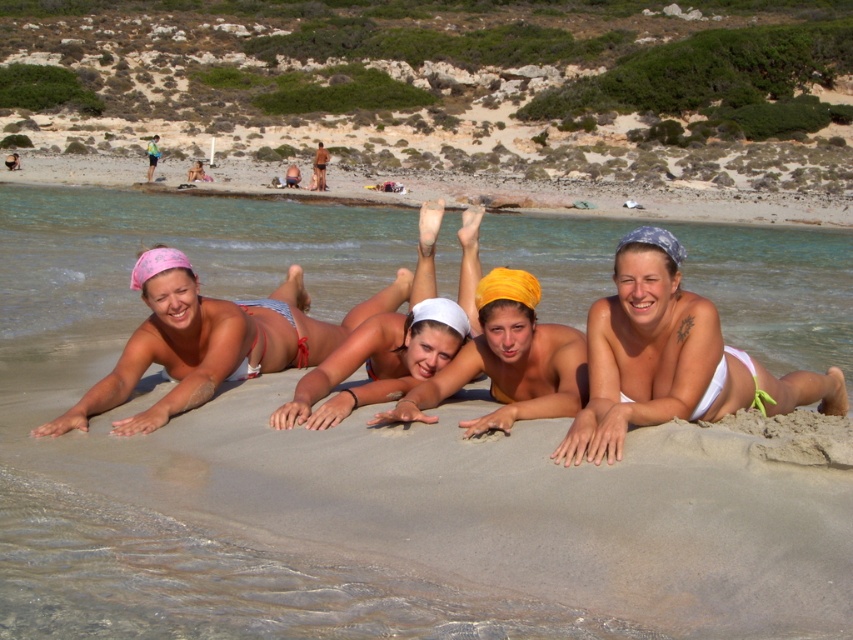
Does white sand at center appear over yellow fabric headscarf at center?

Correct, white sand at center is located above yellow fabric headscarf at center.

Is white sand at center wider than yellow fabric headscarf at center?

Correct, the width of white sand at center exceeds that of yellow fabric headscarf at center.

From the picture: Measure the distance between point (322, 269) and camera.

Point (322, 269) and camera are 48.03 feet apart.

Find the location of a particular element. The height and width of the screenshot is (640, 853). white sand at center is located at coordinates (218, 582).

Can you confirm if white matte bikini at center is taller than matte white bikini at center?

Yes, white matte bikini at center is taller than matte white bikini at center.

Is point (636, 324) farther from viewer compared to point (387, 358)?

No, (636, 324) is in front of (387, 358).

Locate an element on the screen. This screenshot has height=640, width=853. white matte bikini at center is located at coordinates coord(670,356).

This screenshot has width=853, height=640. What are the coordinates of `white matte bikini at center` in the screenshot? It's located at (670, 356).

Is point (146, 365) closer to viewer compared to point (300, 404)?

No, it is behind (300, 404).

Who is more forward, (138, 342) or (469, 298)?

Point (138, 342) is in front.

This screenshot has width=853, height=640. I want to click on pink fabric bikini at center, so click(212, 340).